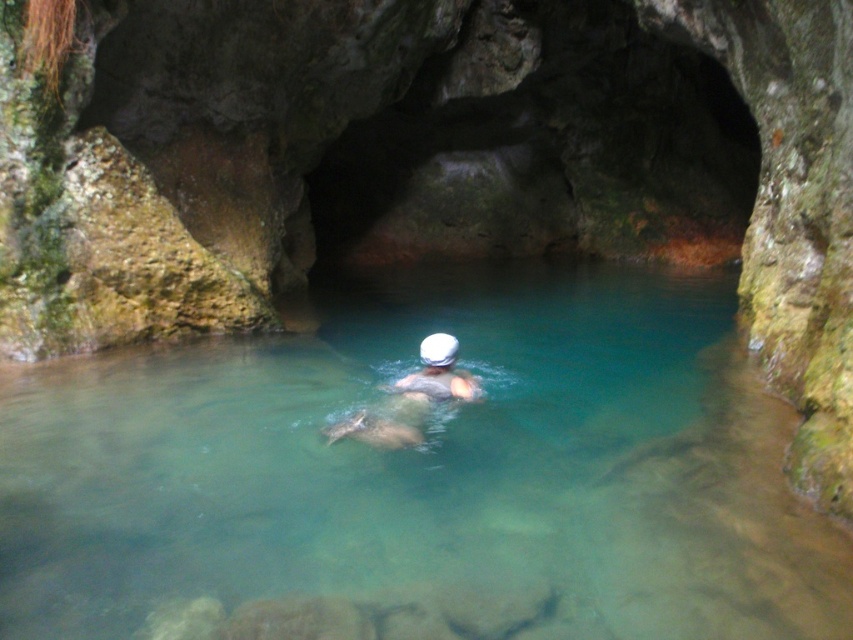
You are a photographer positioned outside the cave entrance. You want to capture a photo of the clear water at center and the white matte swim cap at center. Which object will appear closer to the camera in the photo?

The clear water at center is in front of the white matte swim cap at center, so the clear water at center will appear closer to the camera in the photo.

You are a swimmer who wants to dive into the clear water at center. However, there is a white matte swim cap at center in the way. Can you safely dive into the water without hitting the swim cap?

The clear water at center is much taller than the white matte swim cap at center, so diving into the clear water at center should be safe as there is enough vertical space to avoid hitting the swim cap.